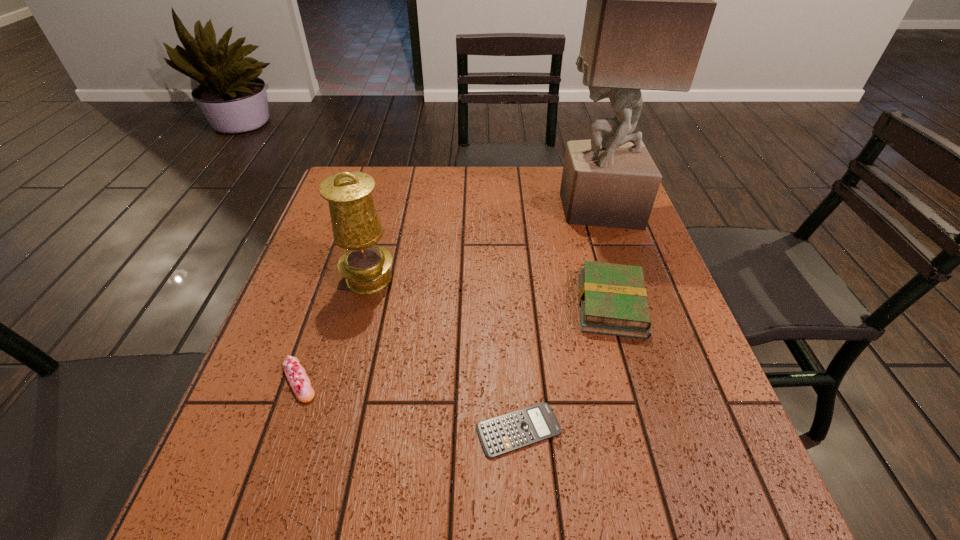
In order to click on vacant space positioned on the front of the oil lamp in this screenshot , I will do `click(333, 420)`.

This screenshot has height=540, width=960. In order to click on vacant space located 0.200m on the back of the third tallest object in this screenshot , I will do (588, 225).

Locate an element on the screen. This screenshot has height=540, width=960. vacant area located on the right of the second shortest object is located at coordinates (516, 381).

The height and width of the screenshot is (540, 960). Find the location of `free space located on the right of the third object from left to right`. free space located on the right of the third object from left to right is located at coordinates (683, 430).

In order to click on object at the far edge in this screenshot , I will do `click(650, 5)`.

Where is `oil lamp located at the left edge`? The height and width of the screenshot is (540, 960). oil lamp located at the left edge is located at coordinates (356, 226).

Find the location of a particular element. The width and height of the screenshot is (960, 540). eclair located at the left edge is located at coordinates (300, 383).

Where is `sculpture that is positioned at the right edge`? The image size is (960, 540). sculpture that is positioned at the right edge is located at coordinates (650, 5).

Locate an element on the screen. book that is at the right edge is located at coordinates (613, 300).

Where is `object that is at the far right corner`? object that is at the far right corner is located at coordinates (650, 5).